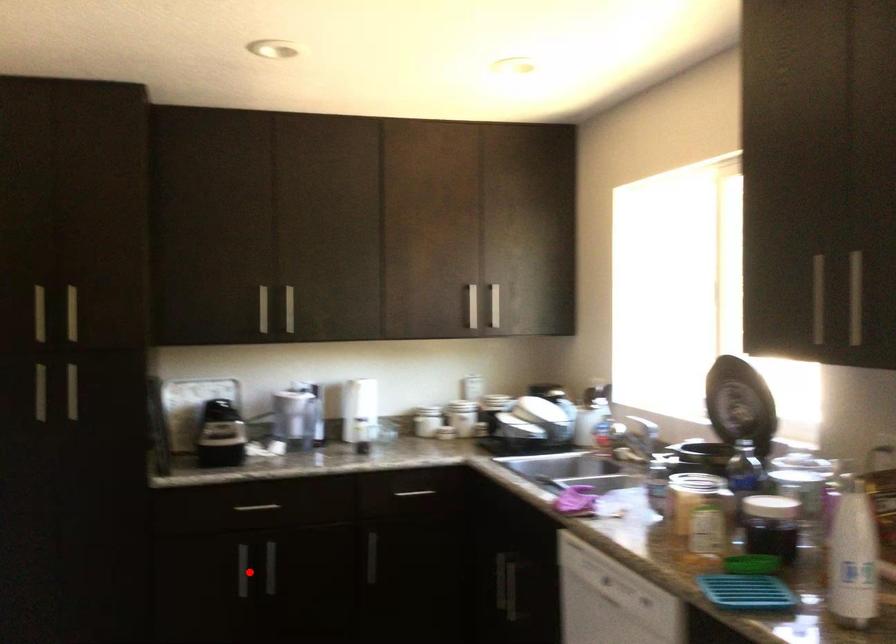
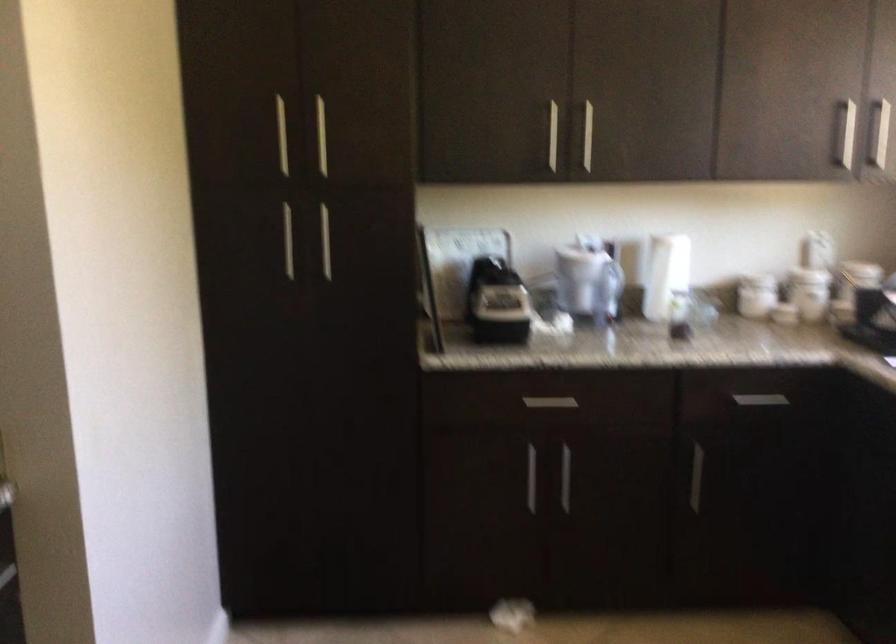
Question: I am providing you with two images of the same scene from different viewpoints. Image1 has a red point marked. In image2, the corresponding 3D location appears at what relative position? Reply with the corresponding letter.

Choices:
 (A) Closer
 (B) Farther

Answer: (A)